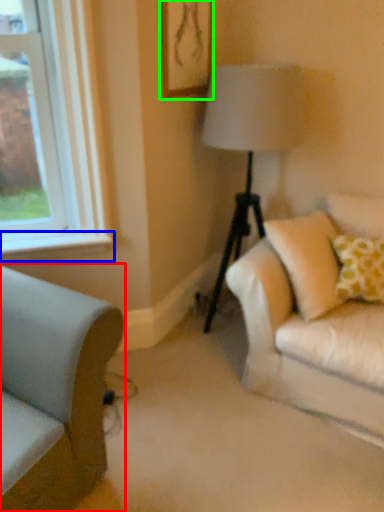
Question: Which object is the farthest from studio couch (highlighted by a red box)? Choose among these: window sill (highlighted by a blue box) or picture frame (highlighted by a green box).

Choices:
 (A) window sill
 (B) picture frame

Answer: (B)